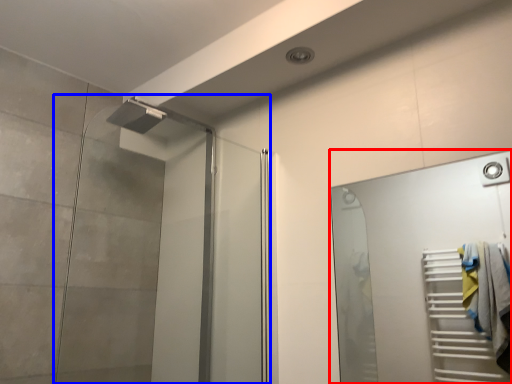
Question: Which object appears farthest to the camera in this image, door (highlighted by a red box) or screen door (highlighted by a blue box)?

Choices:
 (A) door
 (B) screen door

Answer: (B)